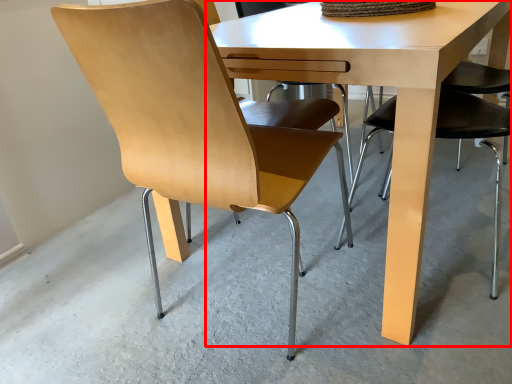
Question: Where is table (annotated by the red box) located in relation to chair in the image?

Choices:
 (A) right
 (B) left

Answer: (A)